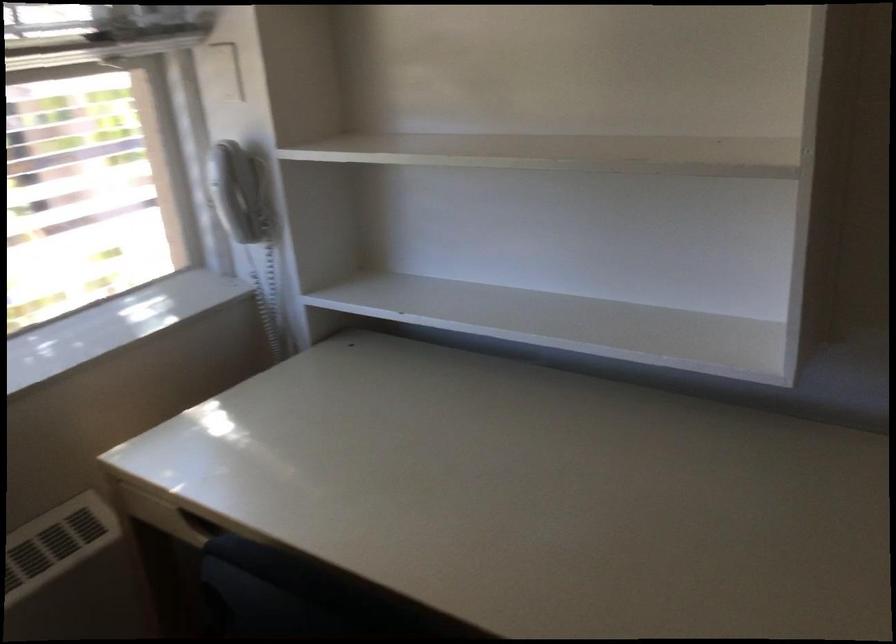
In order to click on drawer handle in this screenshot , I will do `click(216, 549)`.